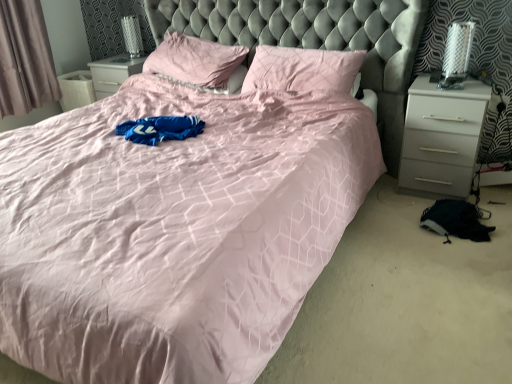
This screenshot has width=512, height=384. I want to click on free space above white glossy nightstand at right (from a real-world perspective), so (x=441, y=85).